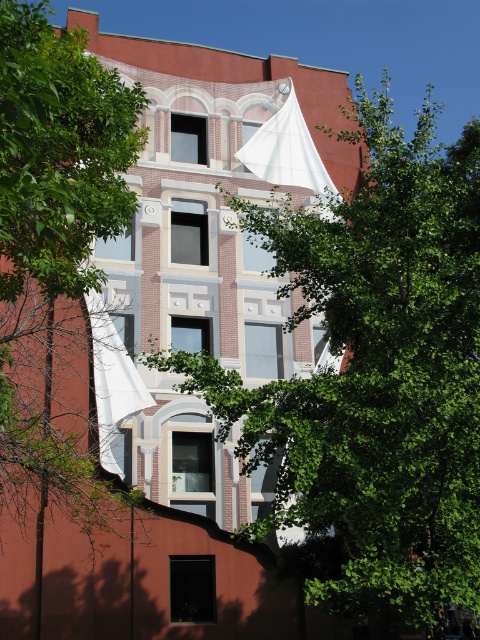
Question: Which point is closer to the camera?

Choices:
 (A) (447, 360)
 (B) (88, 236)

Answer: (B)

Question: Which object is positioned closest to the green leafy tree at upper center?

Choices:
 (A) white fabric canopy at upper center
 (B) green leafy tree at left

Answer: (B)

Question: Does green leafy tree at left have a greater width compared to white fabric canopy at upper center?

Choices:
 (A) yes
 (B) no

Answer: (A)

Question: From the image, what is the correct spatial relationship of green leafy tree at upper center in relation to green leafy tree at left?

Choices:
 (A) above
 (B) below

Answer: (A)

Question: Is green leafy tree at left further to the viewer compared to white fabric canopy at upper center?

Choices:
 (A) yes
 (B) no

Answer: (B)

Question: Which object is farther from the camera taking this photo?

Choices:
 (A) white fabric canopy at upper center
 (B) green leafy tree at upper center

Answer: (A)